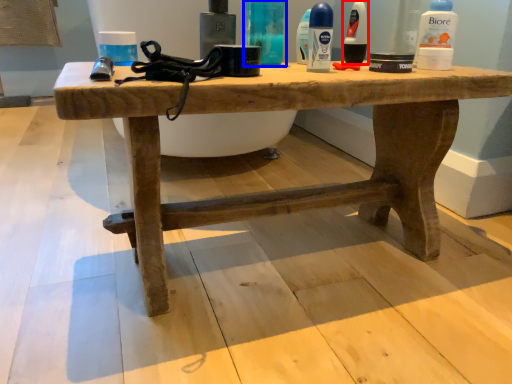
Question: Which of the following is the farthest to the observer, toiletry (highlighted by a red box) or toiletry (highlighted by a blue box)?

Choices:
 (A) toiletry
 (B) toiletry

Answer: (A)